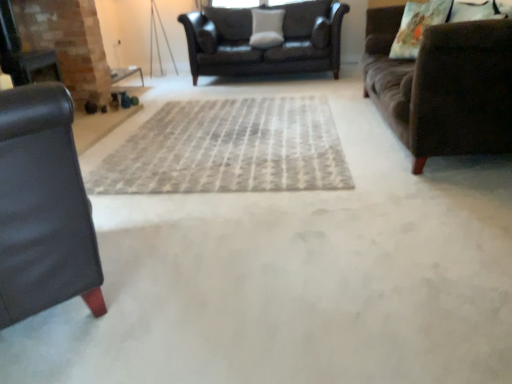
In order to click on unoccupied space behind black leather couch at left, which ranks as the first studio couch in front-to-back order in this screenshot , I will do `click(140, 202)`.